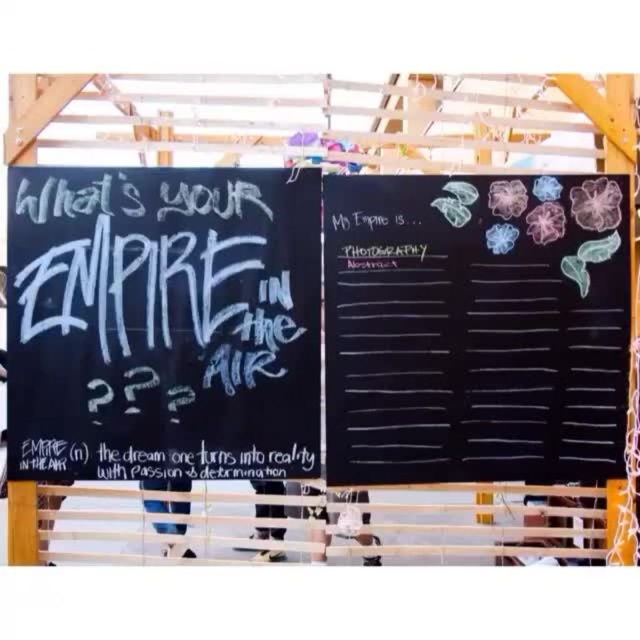
Question: From the image, what is the correct spatial relationship of white chalkboard at left in relation to white chalkboard at center?

Choices:
 (A) left
 (B) right

Answer: (A)

Question: Among these points, which one is farthest from the camera?

Choices:
 (A) 464,321
 (B) 161,211

Answer: (A)

Question: Can you confirm if white chalkboard at left is bigger than white chalkboard at center?

Choices:
 (A) yes
 (B) no

Answer: (A)

Question: Which of the following is the farthest from the observer?

Choices:
 (A) white chalkboard at left
 (B) white chalkboard at center

Answer: (B)

Question: Is the position of white chalkboard at left more distant than that of white chalkboard at center?

Choices:
 (A) no
 (B) yes

Answer: (A)